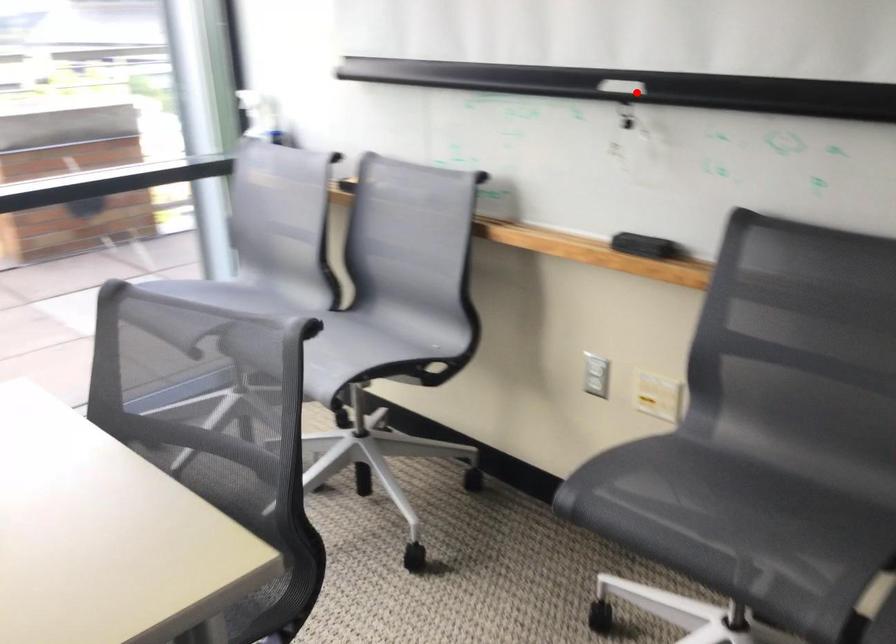
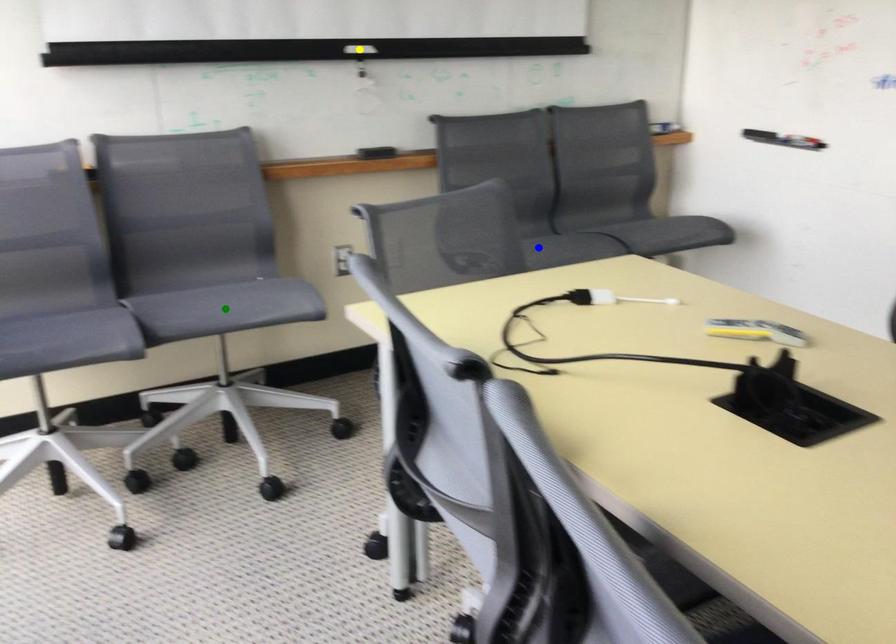
Question: I am providing you with two images of the same scene from different viewpoints. A red point is marked on the first image. You are given multiple points on the second image. Can you choose the point in image 2 that corresponds to the point in image 1?

Choices:
 (A) yellow point
 (B) blue point
 (C) green point

Answer: (A)